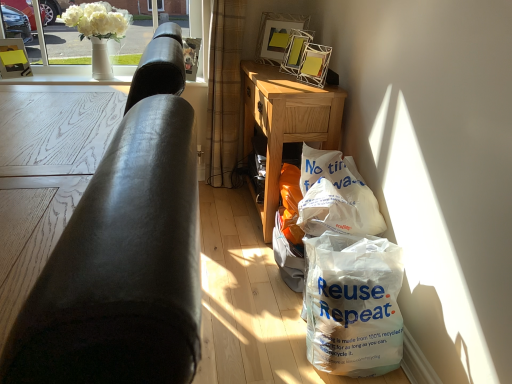
Question: From a real-world perspective, is plaid fabric curtain at center above or below white paper bag at lower right?

Choices:
 (A) above
 (B) below

Answer: (A)

Question: Considering the positions of plaid fabric curtain at center and white paper bag at lower right in the image, is plaid fabric curtain at center bigger or smaller than white paper bag at lower right?

Choices:
 (A) big
 (B) small

Answer: (A)

Question: Which object is positioned farthest from the white plastic bag at lower right?

Choices:
 (A) plaid fabric curtain at center
 (B) white paper bag at lower right
 (C) matte yellow picture frame at upper left, which is counted as the first picture frame, starting from the left
 (D) light brown wood desk at center
 (E) white glass vase at upper center, positioned as the 2th window screen in right-to-left order

Answer: (C)

Question: Which is farther from the white plastic bag at lower right?

Choices:
 (A) light brown wood desk at center
 (B) metallic silver picture frame at upper center, which is the third picture frame in left-to-right order
 (C) white paper bag at lower right
 (D) white glass vase at upper center, positioned as the 2th window screen in right-to-left order
 (E) white ceramic vase at upper left, the 1th window screen positioned from the right

Answer: (E)